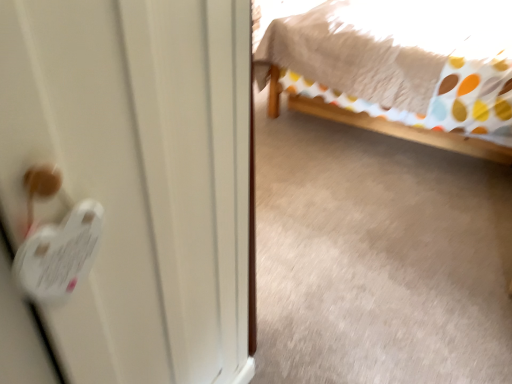
Describe the element at coordinates (399, 69) in the screenshot. This screenshot has height=384, width=512. I see `white fabric bed at upper right` at that location.

Find the location of a particular element. This screenshot has height=384, width=512. white fabric bed at upper right is located at coordinates (399, 69).

At what (x,y) coordinates should I click in order to perform the action: click on white fabric bed at upper right. Please return your answer as a coordinate pair (x, y). The image size is (512, 384). Looking at the image, I should click on (399, 69).